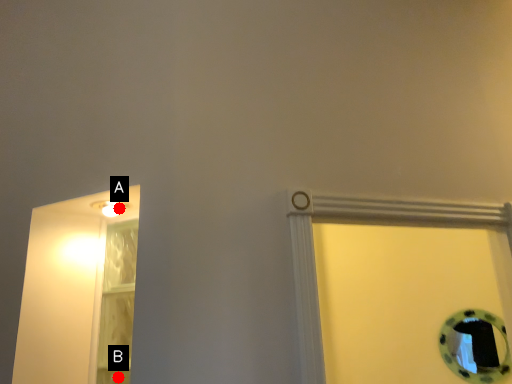
Question: Two points are circled on the image, labeled by A and B beside each circle. Among these points, which one is farthest from the camera?

Choices:
 (A) A is further
 (B) B is further

Answer: (A)